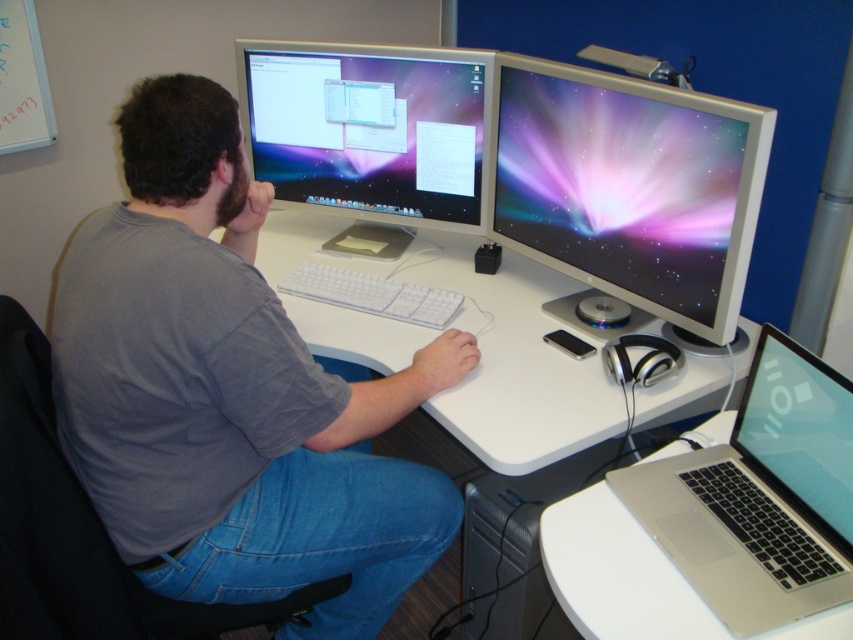
Which is below, satin black monitor at center or white plastic keyboard at center?

white plastic keyboard at center is lower down.

Does satin black monitor at center have a greater height compared to white plastic keyboard at center?

Correct, satin black monitor at center is much taller as white plastic keyboard at center.

Where is `satin black monitor at center`? satin black monitor at center is located at coordinates (369, 134).

Who is taller, satin black laptop at lower right or white plastic keyboard at center?

satin black laptop at lower right

Between point (776, 333) and point (291, 291), which one is positioned in front?

Point (776, 333) is more forward.

Where is `satin black laptop at lower right`? The image size is (853, 640). satin black laptop at lower right is located at coordinates (799, 433).

Is white glossy monitor at right further to camera compared to silver metallic laptop at lower right?

That is True.

Between white glossy monitor at right and silver metallic laptop at lower right, which one is positioned higher?

white glossy monitor at right is above.

In order to click on white glossy monitor at right in this screenshot , I will do `click(630, 186)`.